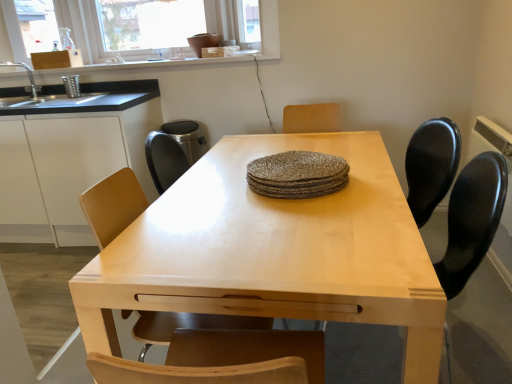
Question: Considering the relative sizes of black plastic swivel chair at right and transparent glass window screen at upper center in the image provided, is black plastic swivel chair at right shorter than transparent glass window screen at upper center?

Choices:
 (A) yes
 (B) no

Answer: (B)

Question: Is black plastic swivel chair at right positioned behind transparent glass window screen at upper center?

Choices:
 (A) yes
 (B) no

Answer: (B)

Question: Is black plastic swivel chair at right turned away from transparent glass window screen at upper center?

Choices:
 (A) yes
 (B) no

Answer: (B)

Question: From a real-world perspective, is black plastic swivel chair at right over transparent glass window screen at upper center?

Choices:
 (A) yes
 (B) no

Answer: (B)

Question: From a real-world perspective, is black plastic swivel chair at right beneath transparent glass window screen at upper center?

Choices:
 (A) no
 (B) yes

Answer: (B)

Question: Does black plastic swivel chair at right have a greater height compared to transparent glass window screen at upper center?

Choices:
 (A) no
 (B) yes

Answer: (B)

Question: Can you confirm if transparent glass window screen at upper center is smaller than black plastic swivel chair at right?

Choices:
 (A) yes
 (B) no

Answer: (A)

Question: Would you say transparent glass window screen at upper center is a long distance from black plastic swivel chair at right?

Choices:
 (A) no
 (B) yes

Answer: (B)

Question: Considering the relative sizes of transparent glass window screen at upper center and black plastic swivel chair at right in the image provided, is transparent glass window screen at upper center wider than black plastic swivel chair at right?

Choices:
 (A) no
 (B) yes

Answer: (A)

Question: Does transparent glass window screen at upper center lie behind black plastic swivel chair at right?

Choices:
 (A) no
 (B) yes

Answer: (B)

Question: Is transparent glass window screen at upper center taller than black plastic swivel chair at right?

Choices:
 (A) yes
 (B) no

Answer: (B)

Question: Is transparent glass window screen at upper center thinner than black plastic swivel chair at right?

Choices:
 (A) yes
 (B) no

Answer: (A)

Question: From the image's perspective, is light wood table at center above white matte cabinet at left?

Choices:
 (A) no
 (B) yes

Answer: (A)